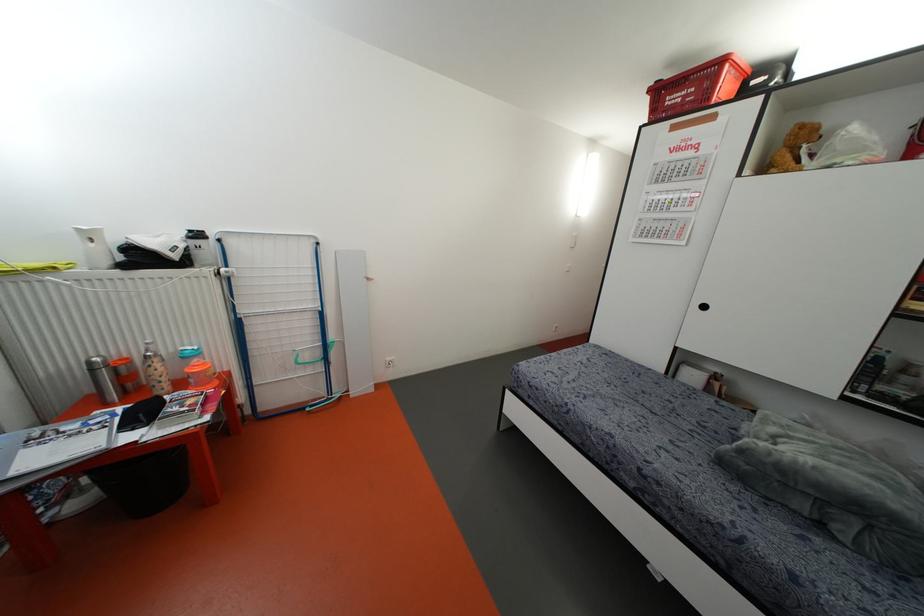
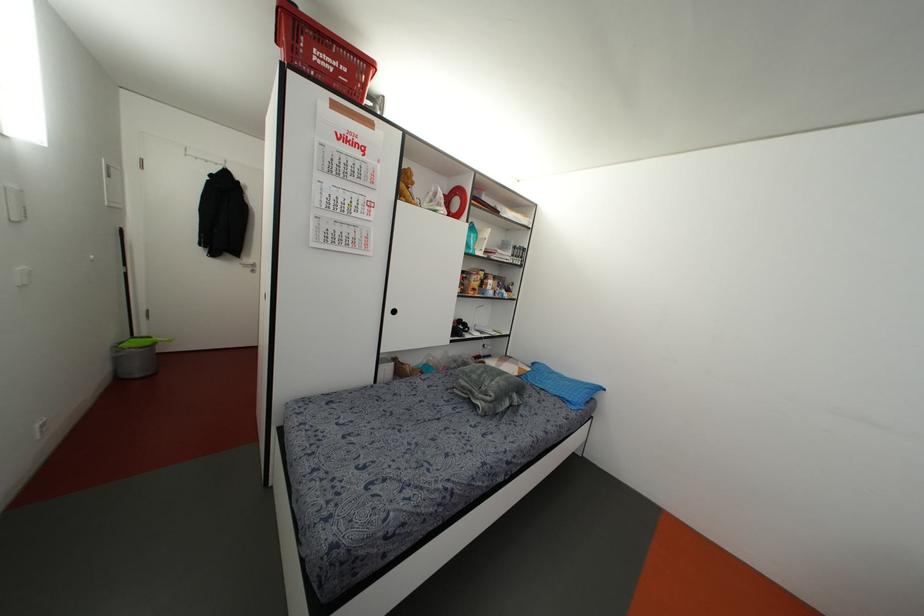
Where in the second image is the point corresponding to point 673,99 from the first image?

(322, 59)